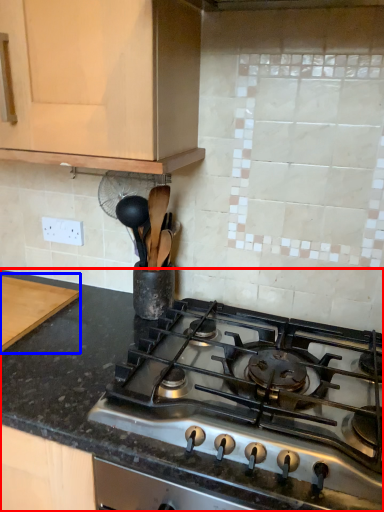
Question: Which object is closer to the camera taking this photo, countertop (highlighted by a red box) or cutting board (highlighted by a blue box)?

Choices:
 (A) countertop
 (B) cutting board

Answer: (A)